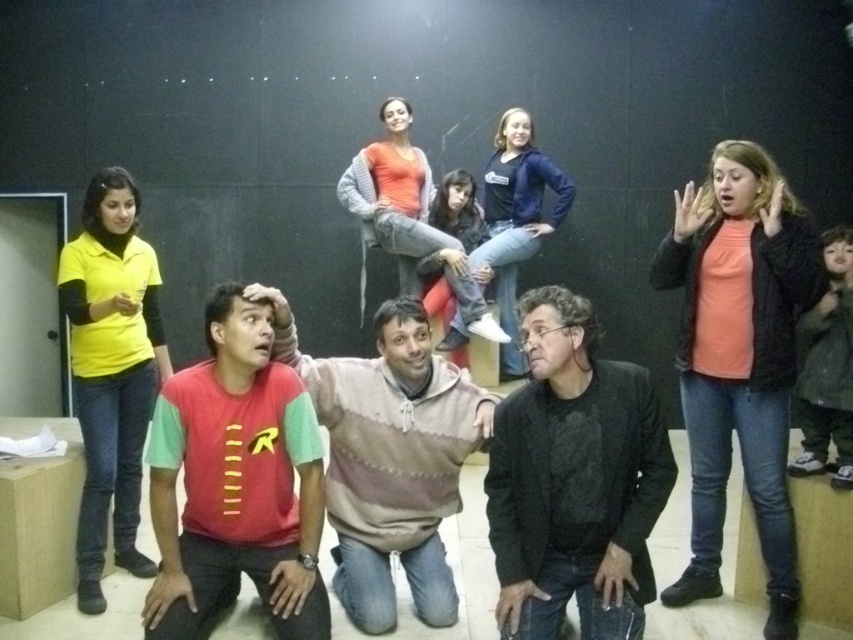
Question: Which point is farther to the camera?

Choices:
 (A) red cotton t-shirt at center
 (B) red matte t-shirt at lower left
 (C) matte orange shirt at upper right
 (D) black textured blazer at center

Answer: (C)

Question: Is matte orange shirt at upper right to the left of matte yellow shirt at left from the viewer's perspective?

Choices:
 (A) no
 (B) yes

Answer: (A)

Question: Can you confirm if matte orange shirt at upper right is positioned below red cotton t-shirt at center?

Choices:
 (A) no
 (B) yes

Answer: (A)

Question: Which point appears farthest from the camera in this image?

Choices:
 (A) (125, 484)
 (B) (171, 528)

Answer: (A)

Question: Can you confirm if black textured blazer at center is positioned above matte yellow shirt at left?

Choices:
 (A) yes
 (B) no

Answer: (B)

Question: Which point is farther to the camera?

Choices:
 (A) (103, 417)
 (B) (703, 456)
 (C) (265, 369)

Answer: (A)